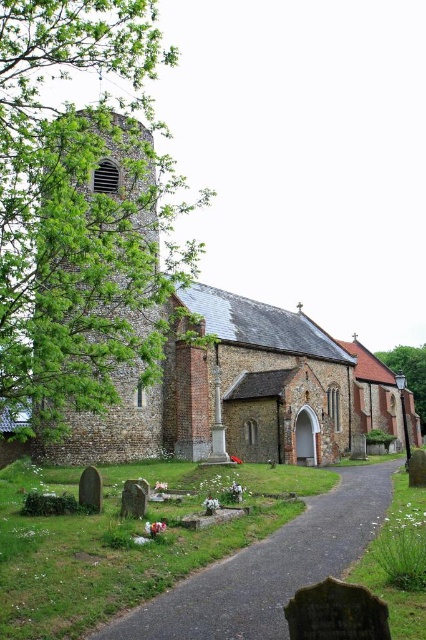
You are standing at the entrance of the historic churchyard and notice a green leafy tree at left and a gravel pathway at center. Which object occupies a larger area in the scene?

The green leafy tree at left is bigger than the gravel pathway at center, so it occupies a larger area in the scene.